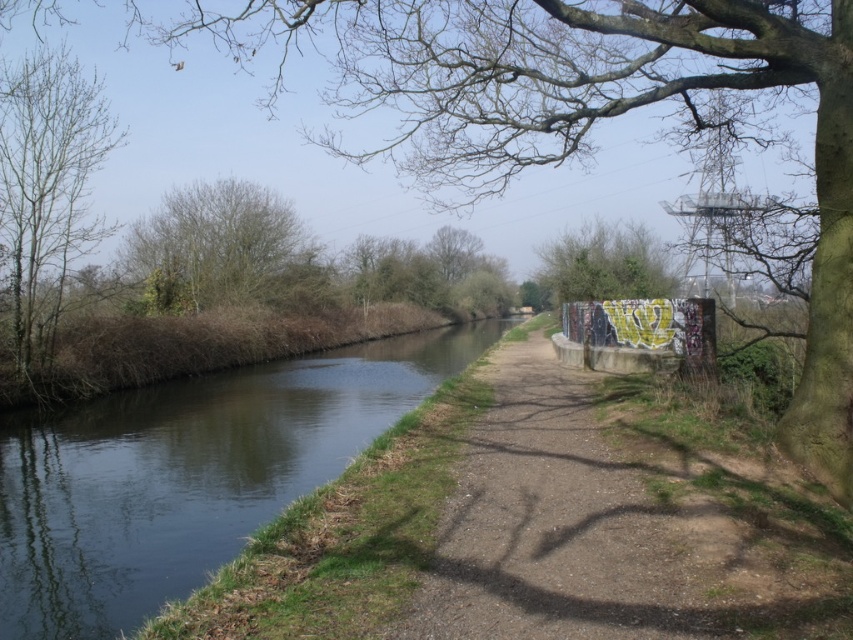
Question: In this image, where is green grassy river at left located relative to bare branches at left?

Choices:
 (A) above
 (B) below

Answer: (B)

Question: Which of the following is the closest to the observer?

Choices:
 (A) (28, 458)
 (B) (817, 596)

Answer: (B)

Question: Does bare branches at left have a larger size compared to green leafy tree at upper left?

Choices:
 (A) no
 (B) yes

Answer: (B)

Question: Which point is farther to the camera?

Choices:
 (A) green leafy tree at upper left
 (B) dirt/gravel path at center
 (C) green grassy river at left

Answer: (A)

Question: Among these points, which one is farthest from the camera?

Choices:
 (A) (341, 452)
 (B) (196, 234)

Answer: (B)

Question: Does bare branches at left lie in front of green leafy tree at upper left?

Choices:
 (A) no
 (B) yes

Answer: (B)